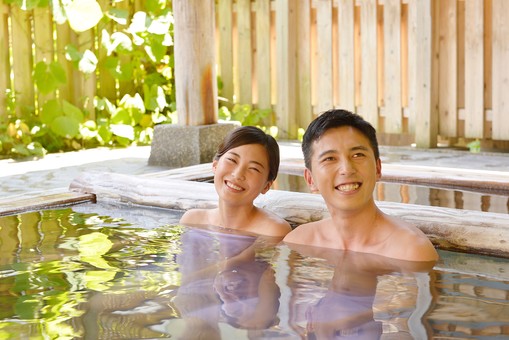
The width and height of the screenshot is (509, 340). What are the coordinates of `wood pillar` in the screenshot? It's located at (197, 99).